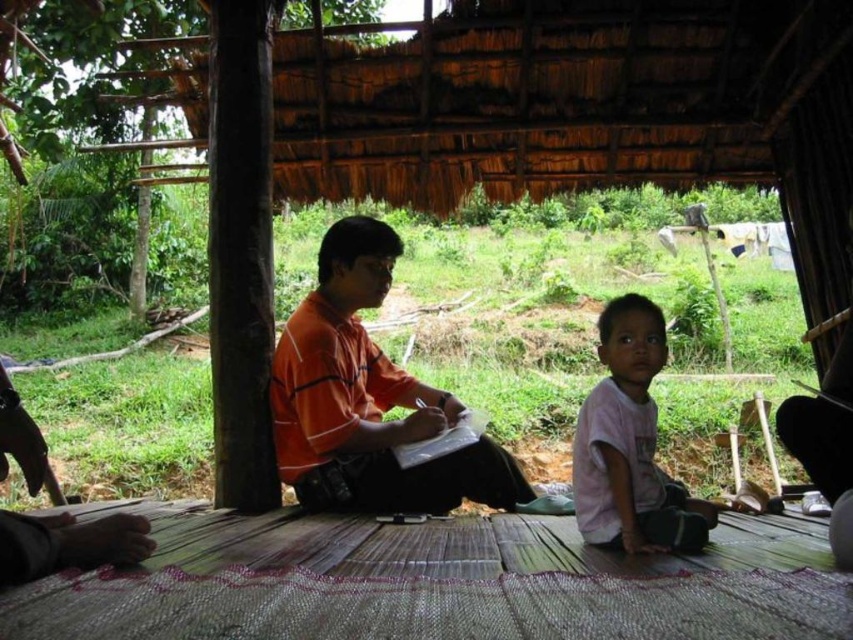
You are a tailor measuring shirts for a customer. You have an orange fabric shirt at center and a white cotton shirt at center. The customer wants to know if the shirts can be placed side by side on a shelf that is 32 inches wide. Can they fit without overlapping?

The distance between the orange fabric shirt at center and white cotton shirt at center is 33.50 inches. Since the shelf is only 32 inches wide, the shirts cannot fit side by side without overlapping.

You are observing two shirts in the scene. The orange fabric shirt at center and the white cotton shirt at center. Which one has a higher position in the image?

The orange fabric shirt at center is taller than the white cotton shirt at center, so the orange fabric shirt at center has a higher position in the image.

You are a photographer standing in front of the rustic hut. You notice two shirts at the center of the image. Which shirt is closer to you, the orange fabric shirt at center or the white cotton shirt at center?

The orange fabric shirt at center is closer to you because it is further to the viewer than the white cotton shirt at center.